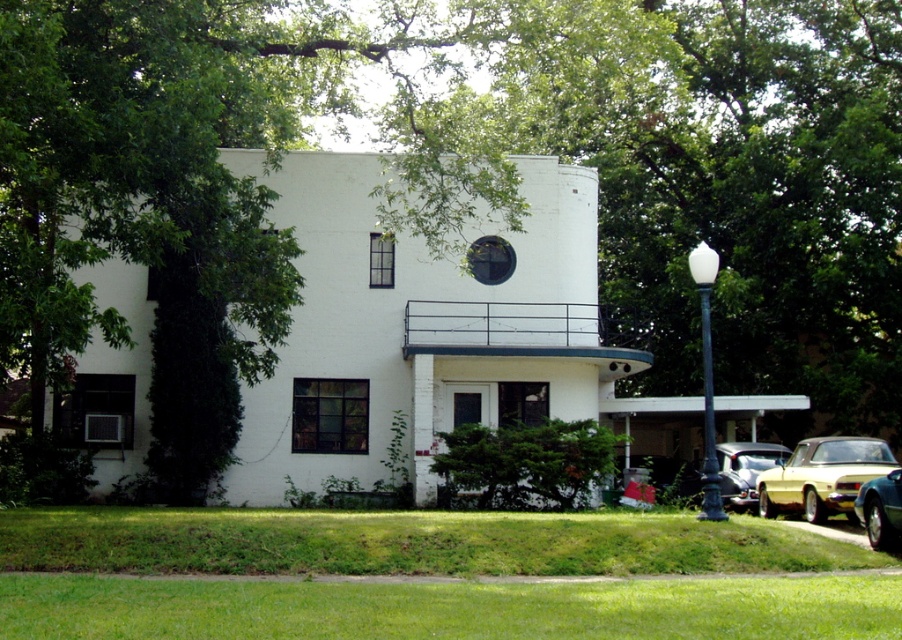
Between gold metallic convertible at lower right and shiny silver car at lower right, which one is positioned lower?

shiny silver car at lower right is below.

Which is behind, point (818, 442) or point (716, 452)?

Positioned behind is point (716, 452).

Locate an element on the screen. gold metallic convertible at lower right is located at coordinates (822, 476).

Who is lower down, green leafy tree at center or shiny silver car at lower right?

shiny silver car at lower right is lower down.

Which is more to the left, green leafy tree at center or shiny silver car at lower right?

Positioned to the left is green leafy tree at center.

This screenshot has height=640, width=902. What do you see at coordinates (272, 152) in the screenshot?
I see `green leafy tree at center` at bounding box center [272, 152].

The image size is (902, 640). Identify the location of green leafy tree at center. (272, 152).

Based on the photo, between shiny silver car at lower right and metallic gold car at lower right, which one is positioned higher?

metallic gold car at lower right

Find the location of a particular element. shiny silver car at lower right is located at coordinates (744, 470).

The width and height of the screenshot is (902, 640). I want to click on shiny silver car at lower right, so click(744, 470).